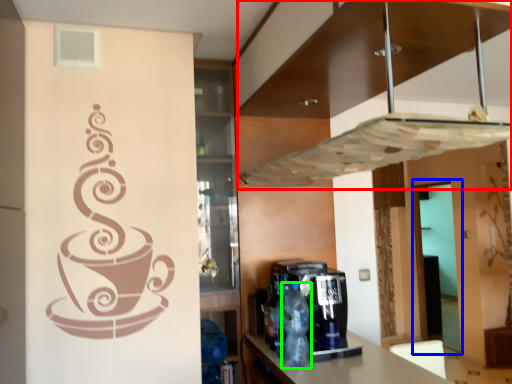
Question: Which is farther away from exhaust hood (highlighted by a red box)? glass door (highlighted by a blue box) or bottle (highlighted by a green box)?

Choices:
 (A) glass door
 (B) bottle

Answer: (A)